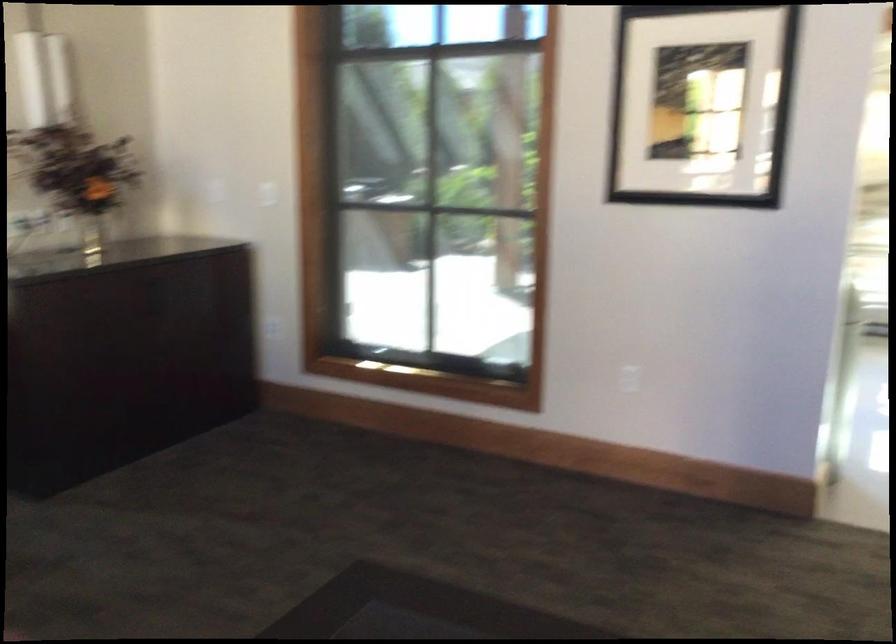
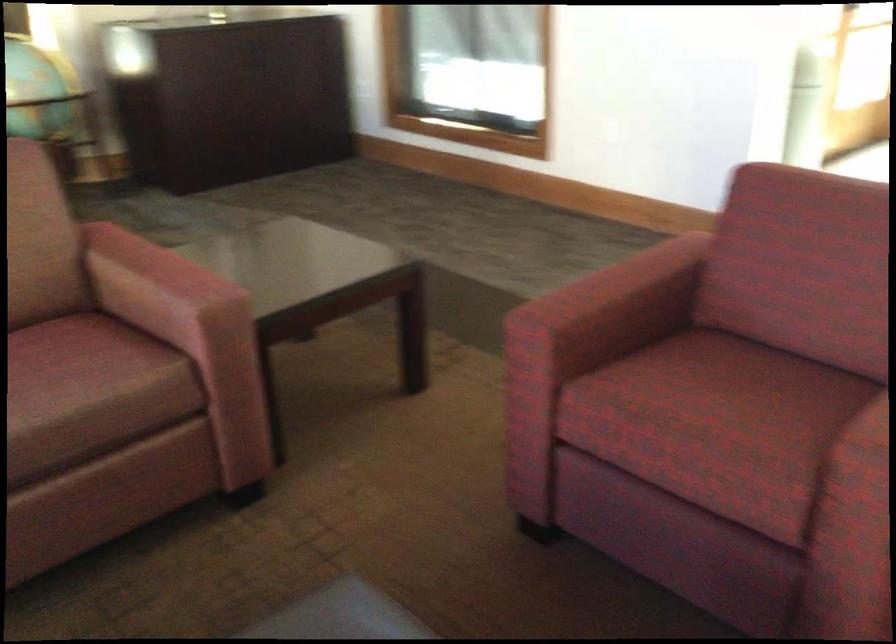
Looking at this image, in a continuous first-person perspective shot, in which direction is the camera moving?

The cameraman moved toward right, backward.